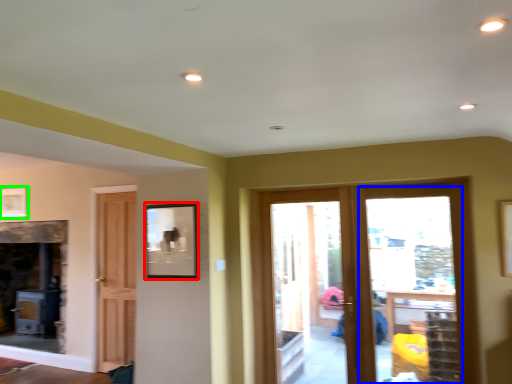
Question: Which is nearer to the picture frame (highlighted by a red box)? glass door (highlighted by a blue box) or picture frame (highlighted by a green box).

Choices:
 (A) glass door
 (B) picture frame

Answer: (A)